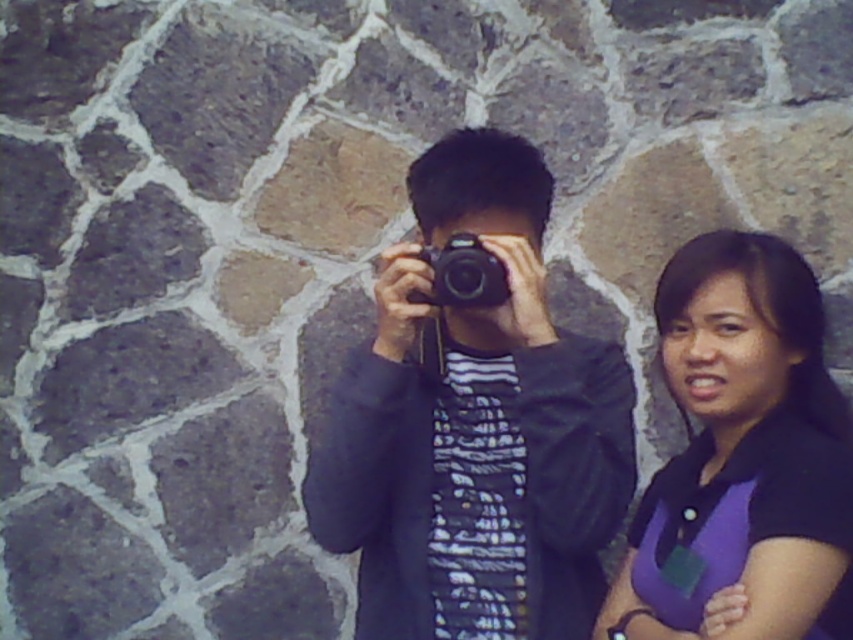
Question: Is matte black camera at center thinner than black plastic camera at center?

Choices:
 (A) yes
 (B) no

Answer: (B)

Question: Which object is the closest to the black plastic camera at center?

Choices:
 (A) matte black camera at center
 (B) purple matte shirt at right

Answer: (A)

Question: Can you confirm if matte black camera at center is positioned below purple matte shirt at right?

Choices:
 (A) no
 (B) yes

Answer: (A)

Question: Is matte black camera at center wider than black plastic camera at center?

Choices:
 (A) yes
 (B) no

Answer: (A)

Question: Among these points, which one is farthest from the camera?

Choices:
 (A) (451, 280)
 (B) (721, 344)
 (C) (451, 340)

Answer: (C)

Question: Based on their relative distances, which object is nearer to the matte black camera at center?

Choices:
 (A) purple matte shirt at right
 (B) black plastic camera at center

Answer: (B)